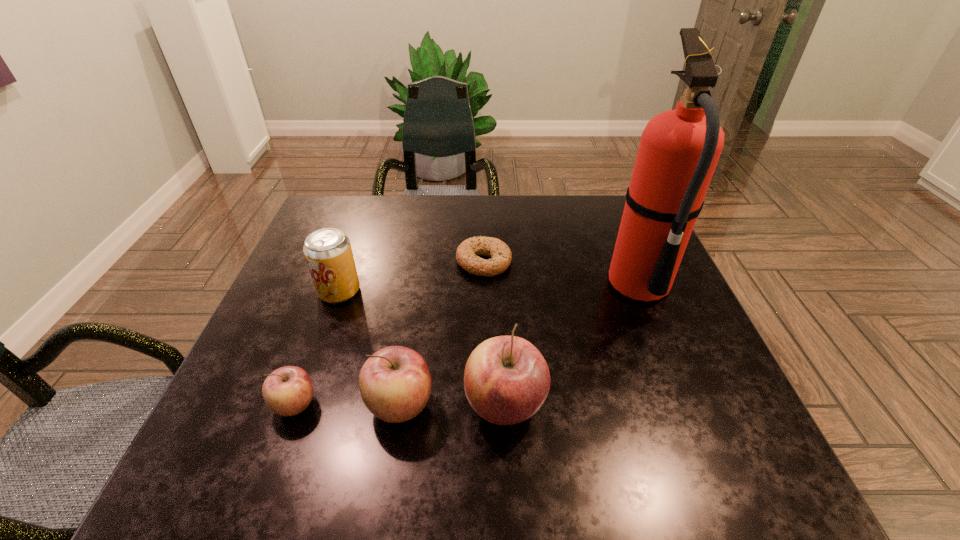
The image size is (960, 540). In order to click on the fifth tallest object in this screenshot , I will do `click(287, 391)`.

Find the location of a particular element. This screenshot has width=960, height=540. the leftmost apple is located at coordinates (287, 391).

This screenshot has height=540, width=960. I want to click on the second tallest apple, so click(x=395, y=383).

Where is `the second apple from right to left`? This screenshot has width=960, height=540. the second apple from right to left is located at coordinates [x=395, y=383].

Locate an element on the screen. the rightmost apple is located at coordinates (506, 380).

The width and height of the screenshot is (960, 540). I want to click on the rightmost object, so click(x=679, y=149).

This screenshot has width=960, height=540. What are the coordinates of `fire extinguisher` in the screenshot? It's located at (679, 149).

At what (x,y) coordinates should I click in order to perform the action: click on pop (soda). Please return your answer as a coordinate pair (x, y). Looking at the image, I should click on (328, 253).

At what (x,y) coordinates should I click in order to perform the action: click on the shortest object. Please return your answer as a coordinate pair (x, y). Looking at the image, I should click on (467, 252).

The image size is (960, 540). In order to click on vacant point located on the right of the leftmost apple in this screenshot , I will do `click(522, 404)`.